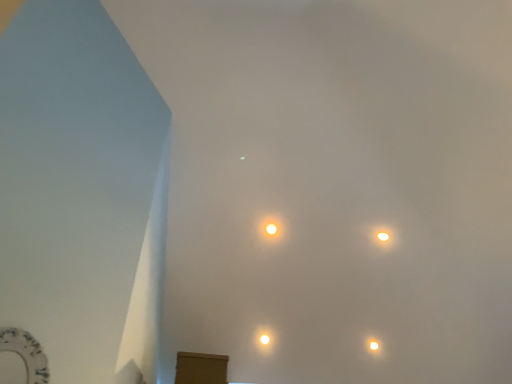
Question: Is matte yellow light at center, which is the first lamp in top-to-bottom order, spatially inside white glossy lamp at center, the 3th lamp positioned from the top, or outside of it?

Choices:
 (A) inside
 (B) outside

Answer: (B)

Question: From the image's perspective, is matte yellow light at center, which is the 3th lamp from bottom to top, positioned above or below white glossy lamp at center, positioned as the third lamp in right-to-left order?

Choices:
 (A) below
 (B) above

Answer: (B)

Question: Which of these objects is positioned closest to the matte yellow light at center, which is the 3th lamp from bottom to top?

Choices:
 (A) white glossy lamp at upper right, which is counted as the 3th lamp, starting from the left
 (B) white glossy lamp at center, the 3th lamp positioned from the top

Answer: (A)

Question: Considering the real-world distances, which object is closest to the white glossy lamp at upper right, which is counted as the 3th lamp, starting from the left?

Choices:
 (A) matte yellow light at center, which is the first lamp in top-to-bottom order
 (B) white glossy lamp at center, positioned as the third lamp in right-to-left order

Answer: (A)